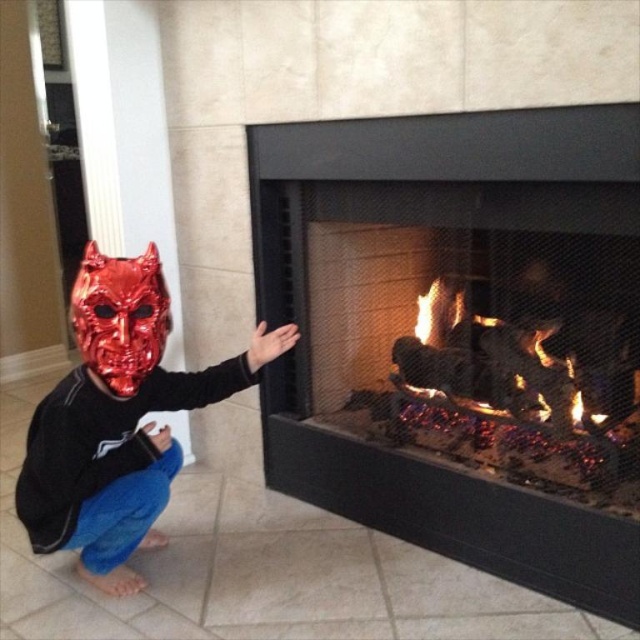
You are a firefighter entering a room and see the charcoal black fireplace at center and the shiny metallic mask at left. Which object is positioned higher from the floor?

The charcoal black fireplace at center is positioned higher than the shiny metallic mask at left because it is above it.

You are a fire safety inspector checking the distance between the charcoal black fireplace at center and the metallic red mask at left. According to safety regulations, the minimum safe distance between a heat source and flammable materials is 90 centimeters. Is the current distance compliant with the safety standards?

The distance between the charcoal black fireplace at center and the metallic red mask at left is 80.39 centimeters, which is less than the required 90 centimeters. Therefore, the current setup does not comply with safety standards.

Based on the scene described, where is the shiny metallic mask at left positioned in terms of coordinates?

The shiny metallic mask at left is positioned at coordinates (118, 419).